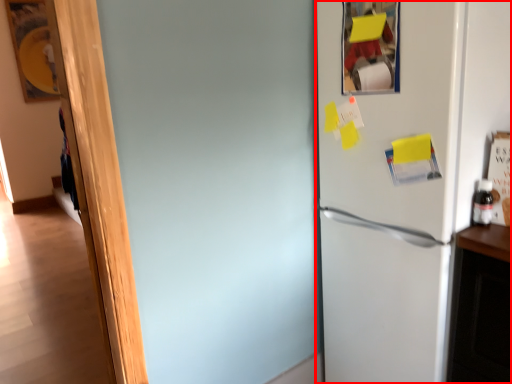
Question: Observing the image, what is the correct spatial positioning of refrigerator (annotated by the red box) in reference to bottle?

Choices:
 (A) left
 (B) right

Answer: (A)